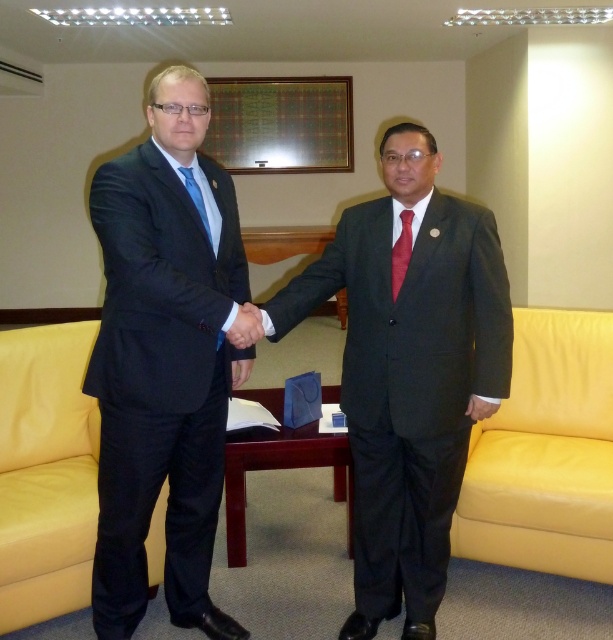
Can you confirm if shiny red tie at center is taller than matte blue tie at left?

Yes, shiny red tie at center is taller than matte blue tie at left.

Is shiny red tie at center in front of matte blue tie at left?

No, shiny red tie at center is behind matte blue tie at left.

Is point (409, 209) positioned after point (186, 172)?

Yes, it is.

Image resolution: width=613 pixels, height=640 pixels. Identify the location of shiny red tie at center. (402, 252).

Is yellow leather couch at right closer to the viewer compared to matte blue tie at left?

No.

Can you confirm if yellow leather couch at right is bigger than matte blue tie at left?

Correct, yellow leather couch at right is larger in size than matte blue tie at left.

Between point (511, 540) and point (192, 189), which one is positioned in front?

Point (192, 189) is more forward.

At what (x,y) coordinates should I click in order to perform the action: click on yellow leather couch at right. Please return your answer as a coordinate pair (x, y). The image size is (613, 640). Looking at the image, I should click on (546, 452).

In the scene shown: Can you confirm if matte black hand at center is thinner than shiny red tie at center?

Incorrect, matte black hand at center's width is not less than shiny red tie at center's.

Is point (243, 346) more distant than point (406, 241)?

No, (243, 346) is in front of (406, 241).

Does point (230, 323) lie in front of point (405, 260)?

Yes.

Where is `matte black hand at center`? This screenshot has width=613, height=640. matte black hand at center is located at coordinates (245, 326).